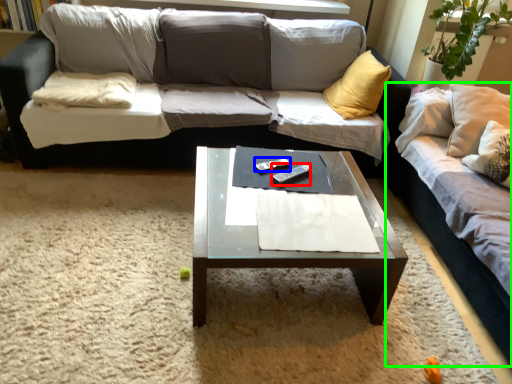
Question: Based on their relative distances, which object is farther from remote (highlighted by a red box)? Choose from remote (highlighted by a blue box) and studio couch (highlighted by a green box).

Choices:
 (A) remote
 (B) studio couch

Answer: (B)